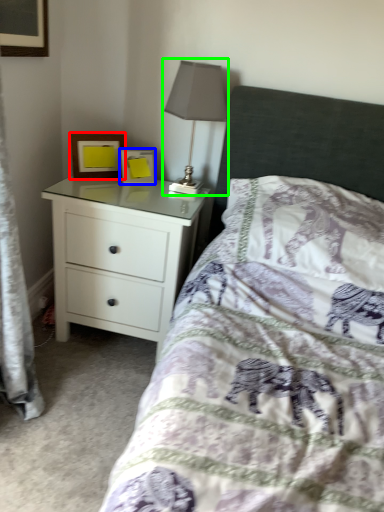
Question: Which object is positioned closest to picture frame (highlighted by a red box)? Select from picture frame (highlighted by a blue box) and table lamp (highlighted by a green box).

Choices:
 (A) picture frame
 (B) table lamp

Answer: (A)